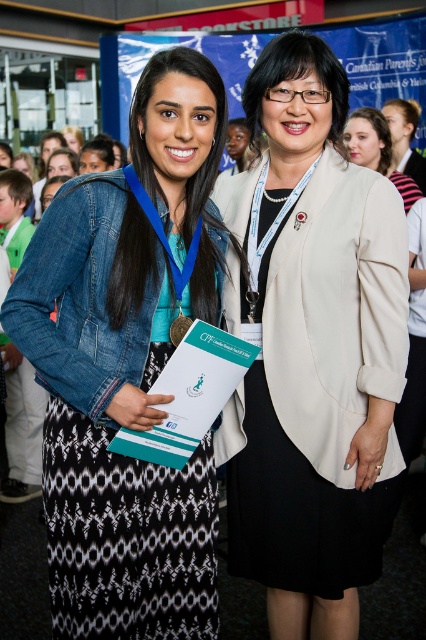
You are a photographer at the event and need to adjust the camera angle to ensure both the beige fabric blazer at center and the denim jacket at left are in focus. Given that the camera has a depth of field that can cover 13 inches, will both items be in focus?

The beige fabric blazer at center is 13.11 inches from the denim jacket at left. Since the distance between them exceeds the camera depth of field of 13 inches, they may not both be in focus simultaneously.

Consider the image. You are organizing a photo shoot and need to ensure that the two blazers in the image are displayed properly. Given that the beige fabric blazer at center and the matte beige blazer at upper center are both part of the setup, which one requires a wider hanger to accommodate its size?

The beige fabric blazer at center requires a wider hanger because its width is larger than the matte beige blazer at upper center.